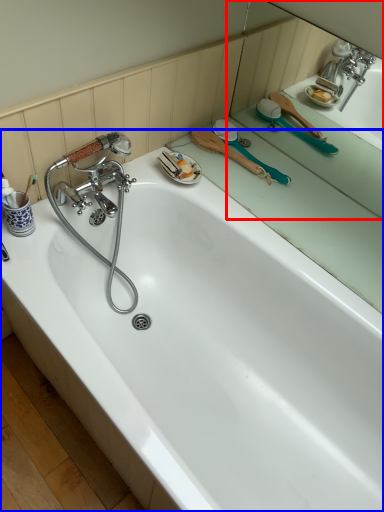
Question: Which object is further to the camera taking this photo, mirror (highlighted by a red box) or bathtub (highlighted by a blue box)?

Choices:
 (A) mirror
 (B) bathtub

Answer: (A)